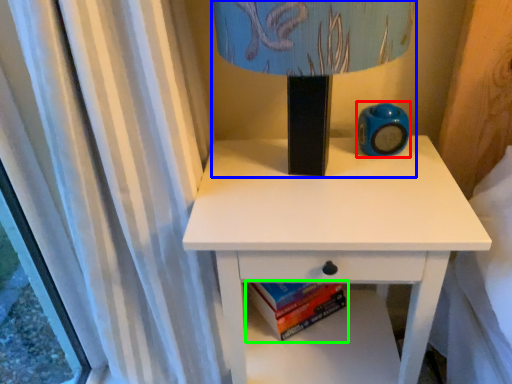
Question: Which object is the closest to the teal (highlighted by a red box)? Choose among these: table lamp (highlighted by a blue box) or paperback book (highlighted by a green box).

Choices:
 (A) table lamp
 (B) paperback book

Answer: (A)